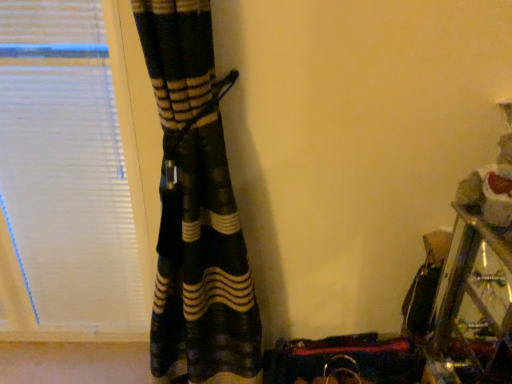
This screenshot has width=512, height=384. What are the coordinates of `metallic silver table at lower right` in the screenshot? It's located at (472, 307).

The image size is (512, 384). Describe the element at coordinates (472, 307) in the screenshot. I see `metallic silver table at lower right` at that location.

Find the location of a particular element. This screenshot has height=384, width=512. metallic silver table at lower right is located at coordinates (472, 307).